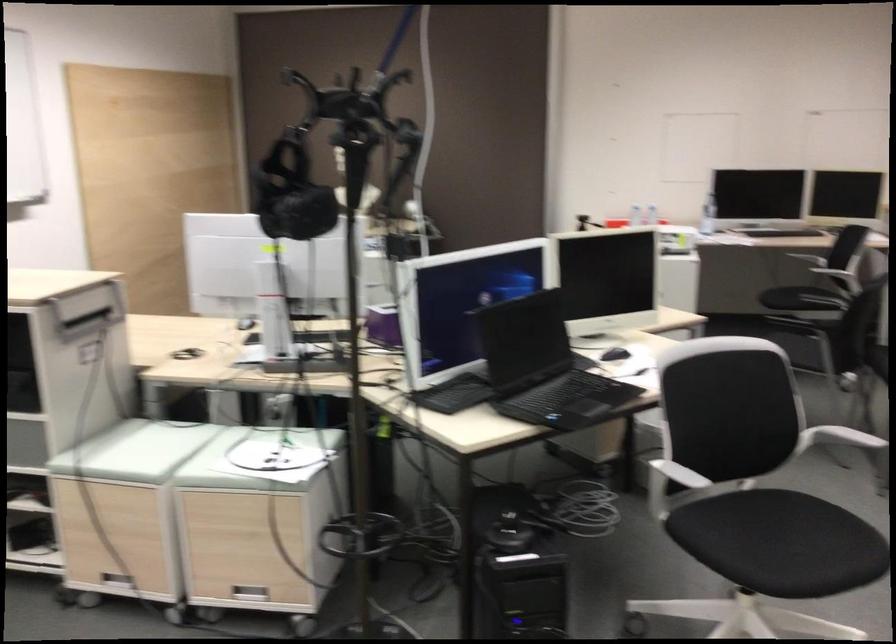
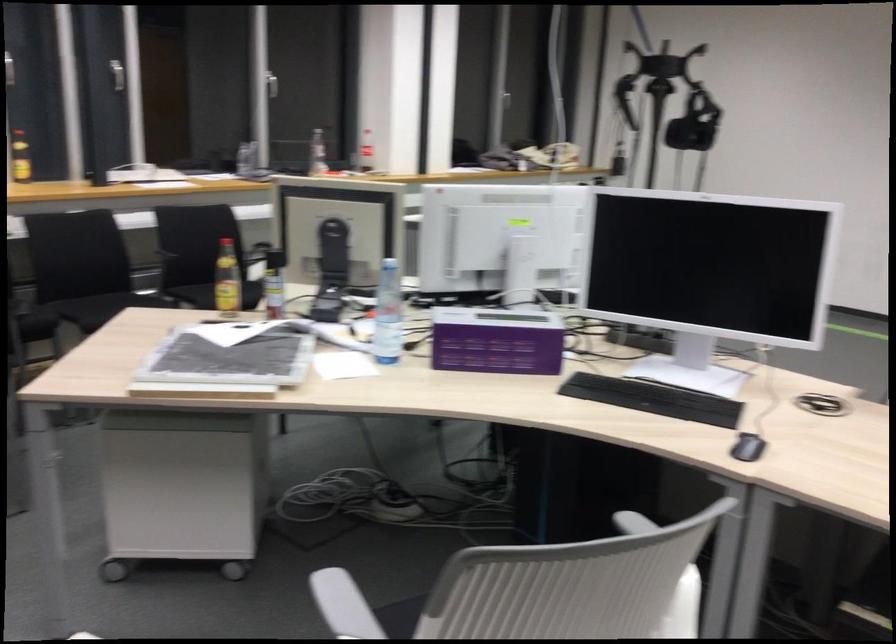
Where in the second image is the point corresponding to (x=550, y=437) from the first image?

(234, 569)